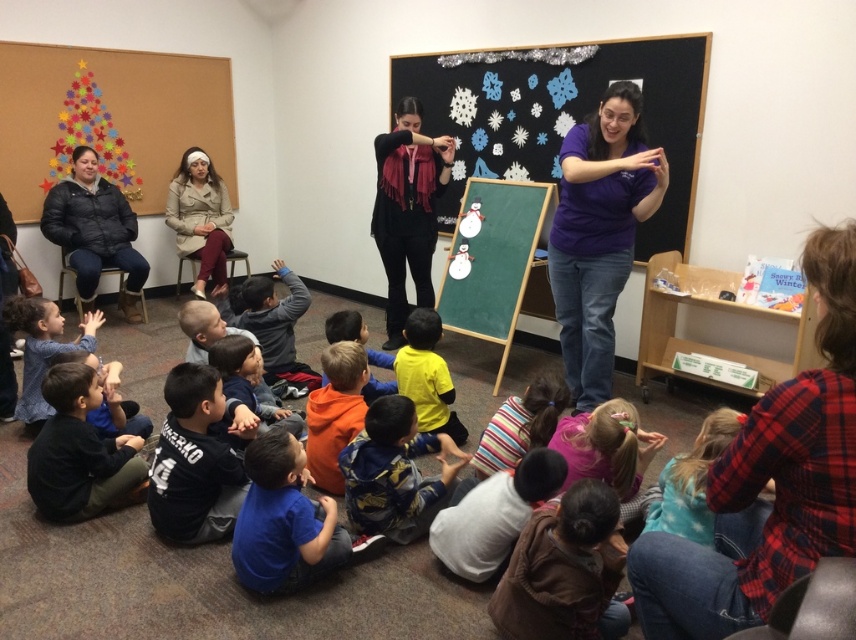
You are a photographer trying to capture a photo of the two children wearing the brown fuzzy jacket at lower right and the yellow matte shirt at center. Since you want both to be in focus, you need to know which one is shorter. Which child is shorter?

The brown fuzzy jacket at lower right has a lesser height compared to the yellow matte shirt at center, so the child wearing the brown fuzzy jacket at lower right is shorter.

You are standing in the classroom and see two points marked on the chalkboard. Which point is closer to you, point [586,609] or point [437,324]?

Point [586,609] is closer to the viewer than point [437,324].